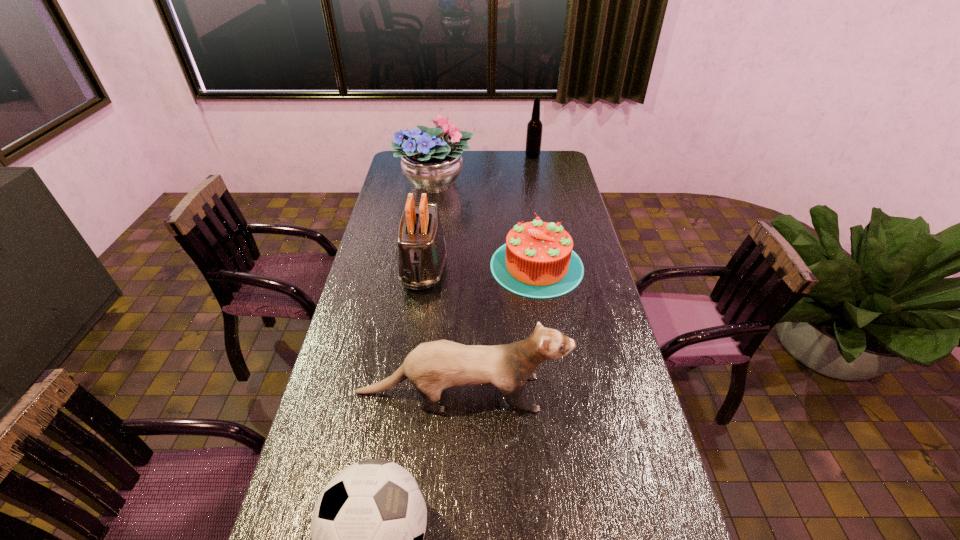
Find the location of a particular element. vacant position at the left edge of the desktop is located at coordinates (419, 195).

Find the location of `free space at the right edge`. free space at the right edge is located at coordinates (587, 270).

In the image, there is a desktop. Where is `free space at the far right corner`? free space at the far right corner is located at coordinates (559, 164).

The width and height of the screenshot is (960, 540). Find the location of `vacant area that lies between the shortest object and the beer bottle`. vacant area that lies between the shortest object and the beer bottle is located at coordinates (535, 211).

Where is `free space between the cake and the beer bottle`? The width and height of the screenshot is (960, 540). free space between the cake and the beer bottle is located at coordinates (535, 211).

The image size is (960, 540). What are the coordinates of `blank region between the toaster and the farthest object` in the screenshot? It's located at (478, 212).

Where is `free space between the cake and the toaster`? The image size is (960, 540). free space between the cake and the toaster is located at coordinates (480, 266).

Identify which object is the third closest to the nearest object. Please provide its 2D coordinates. Your answer should be formatted as a tuple, i.e. [(x, y)], where the tuple contains the x and y coordinates of a point satisfying the conditions above.

[(537, 261)]

Locate an element on the screen. This screenshot has width=960, height=540. object that is the third closest to the toaster is located at coordinates (434, 366).